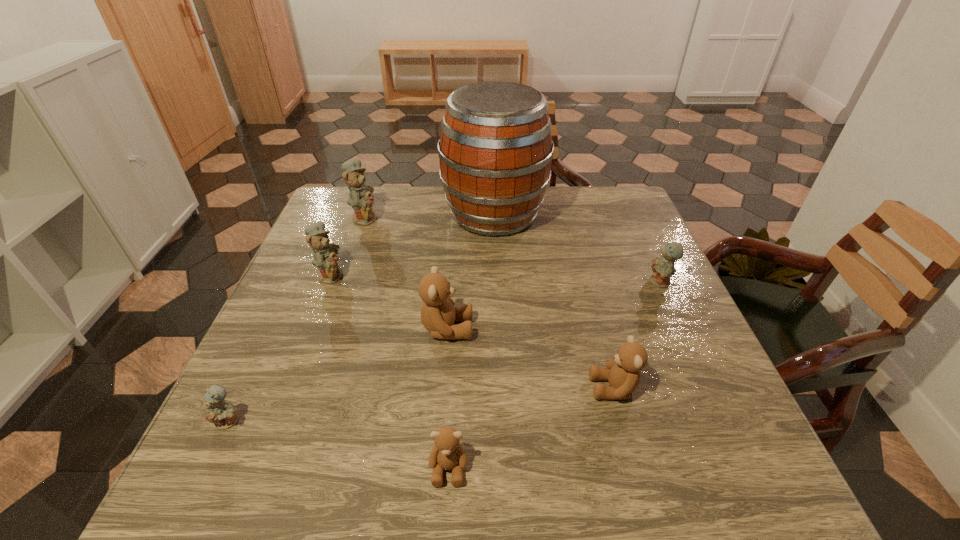
Locate an element on the screen. unoccupied position between the second nearest brown teddy bear and the rightmost object is located at coordinates (637, 335).

This screenshot has height=540, width=960. What are the coordinates of `free space between the tallest object and the nearest brown teddy bear` in the screenshot? It's located at (471, 341).

The width and height of the screenshot is (960, 540). Identify the location of vacant point located between the tallest object and the tallest teddy bear. (429, 215).

What are the coordinates of `empty space between the smallest blue teddy bear and the tallest object` in the screenshot? It's located at (362, 318).

You are a GUI agent. You are given a task and a screenshot of the screen. Output one action in this format:
    pyautogui.click(x=<x>, y=<y>)
    Task: Click on the vacant point located between the second nearest brown teddy bear and the second biggest blue teddy bear
    
    Given the screenshot: What is the action you would take?
    pyautogui.click(x=472, y=331)

The image size is (960, 540). What are the coordinates of `empty location between the tallest object and the third smallest blue teddy bear` in the screenshot? It's located at (413, 244).

This screenshot has width=960, height=540. I want to click on object that is the sixth closest to the farthest blue teddy bear, so click(x=623, y=372).

Identify which object is the seventh nearest to the leftmost blue teddy bear. Please provide its 2D coordinates. Your answer should be formatted as a tuple, i.e. [(x, y)], where the tuple contains the x and y coordinates of a point satisfying the conditions above.

[(663, 267)]

Select which teddy bear appears as the second closest to the second smallest blue teddy bear. Please provide its 2D coordinates. Your answer should be formatted as a tuple, i.e. [(x, y)], where the tuple contains the x and y coordinates of a point satisfying the conditions above.

[(438, 314)]

Find the location of `teddy bear that is the third closest to the third nearest teddy bear`. teddy bear that is the third closest to the third nearest teddy bear is located at coordinates (663, 267).